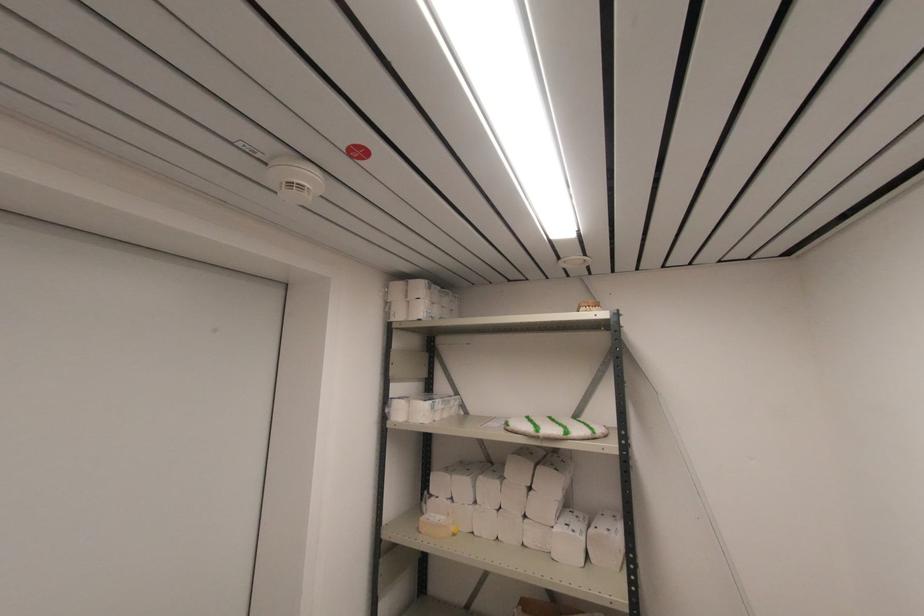
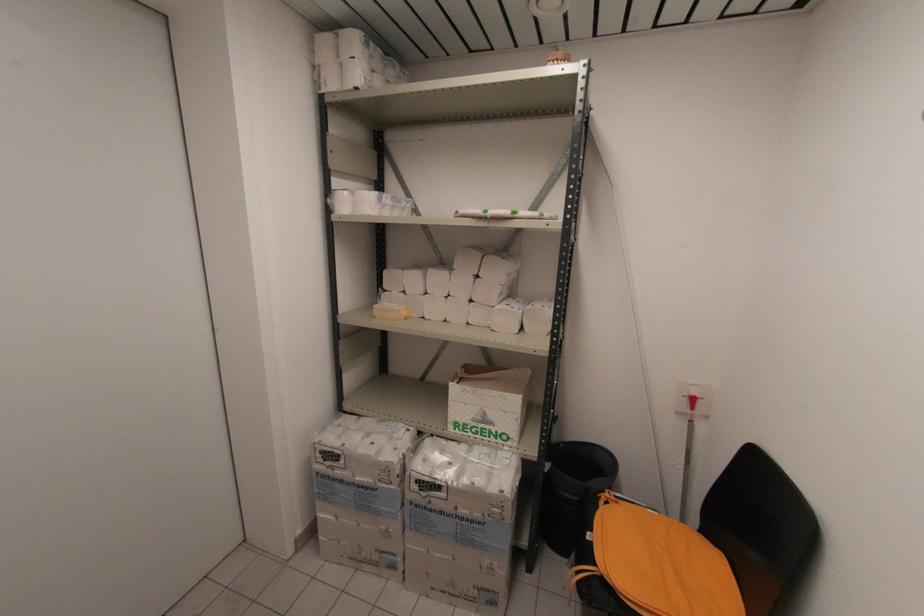
Question: Based on the continuous images, in which direction is the camera rotating? Reply with the corresponding letter.

Choices:
 (A) Left
 (B) Right
 (C) Up
 (D) Down

Answer: (D)